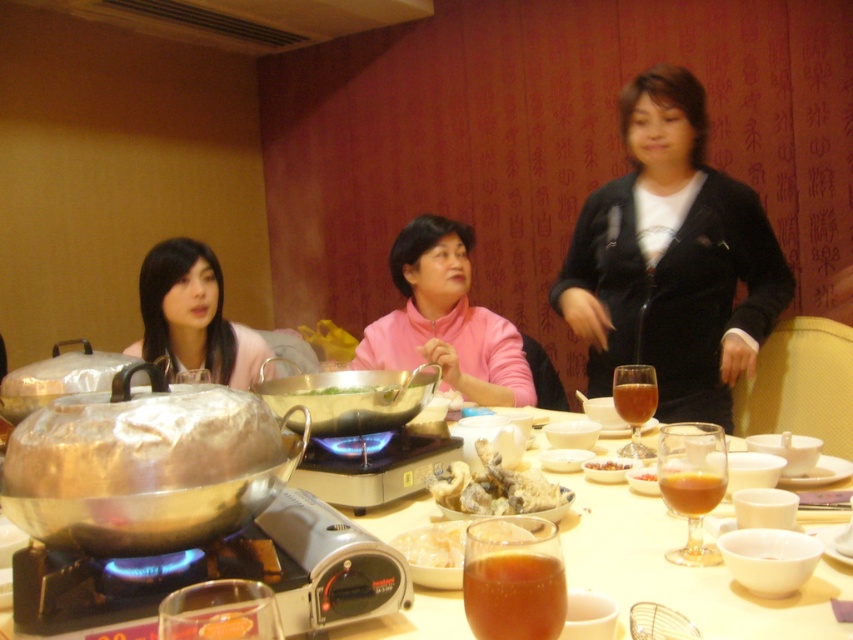
Based on the photo, you are a guest at this restaurant and want to place your black velvet jacket at upper right on a hanger. The hanger is located at point 0.5, 0.5. Can you directly walk towards the hanger from your current position at point (671,259) without any obstacles?

The black velvet jacket at upper right is represented by point (671,259). Since the hanger is at point 0.5, 0.5, you can directly walk towards the hanger without any obstacles as there are no objects mentioned between these points in the scene description.